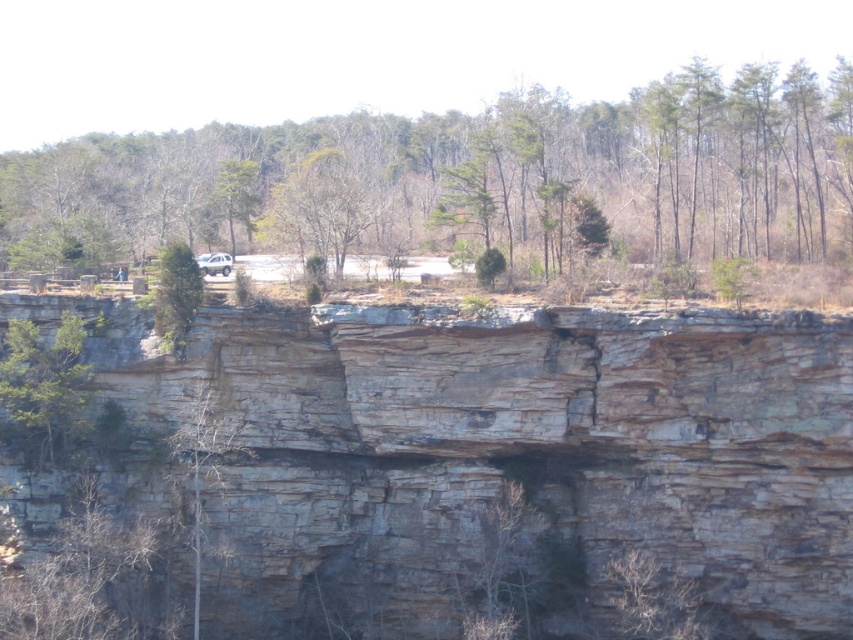
Does green leafy tree at upper center appear on the left side of green leafy tree at left?

In fact, green leafy tree at upper center is to the right of green leafy tree at left.

Does green leafy tree at upper center appear under green leafy tree at left?

Actually, green leafy tree at upper center is above green leafy tree at left.

Does point (300, 138) come closer to viewer compared to point (7, 321)?

That is False.

Locate an element on the screen. This screenshot has height=640, width=853. green leafy tree at upper center is located at coordinates (463, 179).

The image size is (853, 640). What do you see at coordinates (451, 467) in the screenshot?
I see `gray rock cliff at center` at bounding box center [451, 467].

Which is more to the left, gray rock cliff at center or green leafy tree at upper left?

green leafy tree at upper left is more to the left.

Where is `gray rock cliff at center`? gray rock cliff at center is located at coordinates (451, 467).

Find the location of a particular element. gray rock cliff at center is located at coordinates (451, 467).

Does gray rock cliff at center appear under green leafy tree at upper center?

Yes.

Is gray rock cliff at center to the left of green leafy tree at upper center from the viewer's perspective?

In fact, gray rock cliff at center is to the right of green leafy tree at upper center.

Between point (480, 524) and point (755, 179), which one is positioned behind?

Point (755, 179)

This screenshot has height=640, width=853. I want to click on gray rock cliff at center, so click(451, 467).